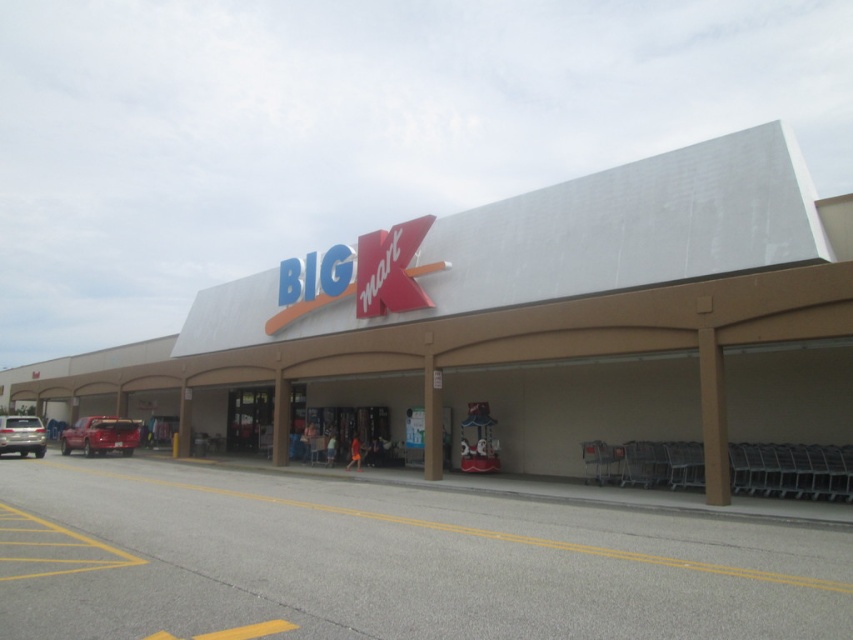
Question: Which point is farther to the camera?

Choices:
 (A) satin silver car at lower left
 (B) shiny red truck at lower left

Answer: (B)

Question: Can you confirm if white concrete mall at center is smaller than satin silver car at lower left?

Choices:
 (A) yes
 (B) no

Answer: (B)

Question: From the image, what is the correct spatial relationship of shiny red truck at lower left in relation to satin silver car at lower left?

Choices:
 (A) above
 (B) below

Answer: (B)

Question: Among these objects, which one is nearest to the camera?

Choices:
 (A) shiny red truck at lower left
 (B) satin silver car at lower left

Answer: (B)

Question: Which of the following is the farthest from the observer?

Choices:
 (A) (9, 419)
 (B) (769, 161)

Answer: (A)

Question: Does shiny red truck at lower left lie in front of satin silver car at lower left?

Choices:
 (A) no
 (B) yes

Answer: (A)